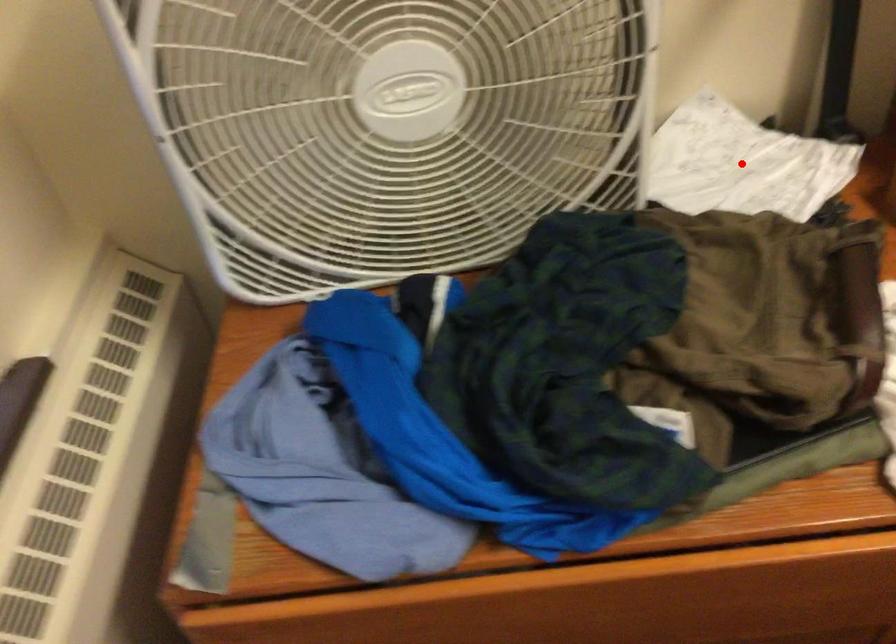
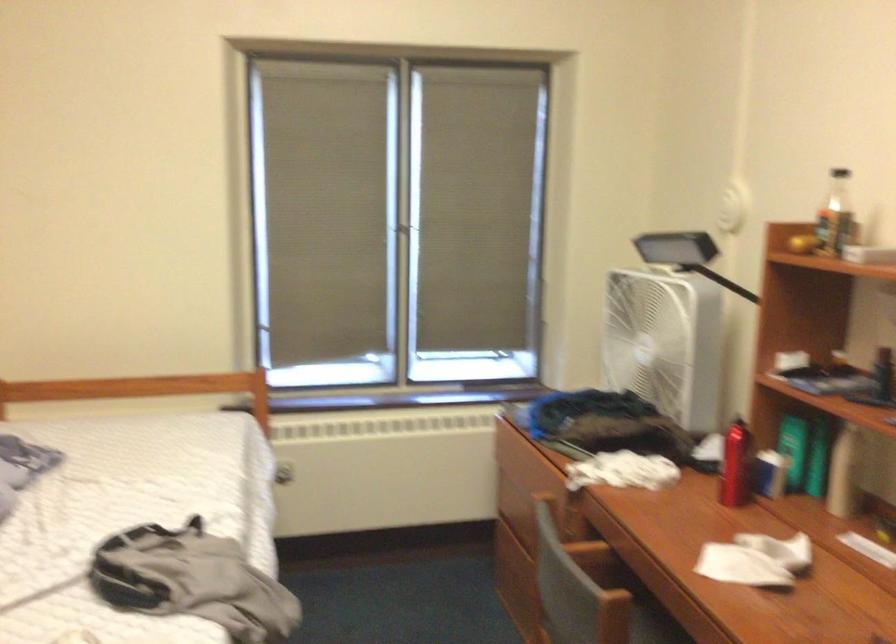
Question: I am providing you with two images of the same scene from different viewpoints. A red point is marked on the first image. At the location where the point appears in image 1, is it still visible in image 2?

Choices:
 (A) Yes
 (B) No

Answer: (B)